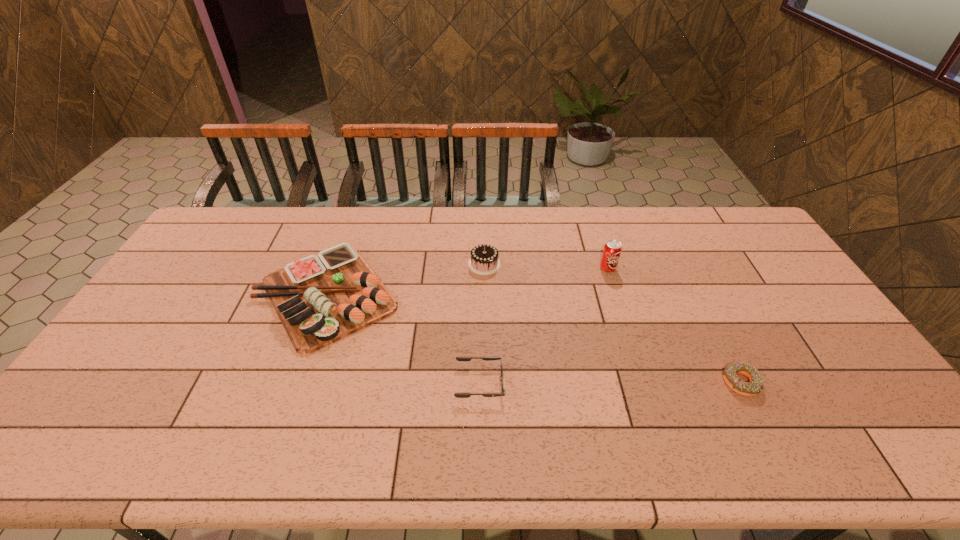
At what (x,y) coordinates should I click in order to perform the action: click on free space that is in between the tallest object and the rightmost object. Please return your answer as a coordinate pair (x, y). Image resolution: width=960 pixels, height=540 pixels. Looking at the image, I should click on (674, 326).

Find the location of a particular element. This screenshot has height=540, width=960. vacant region between the platter and the sunglasses is located at coordinates [x=403, y=339].

Locate an element on the screen. Image resolution: width=960 pixels, height=540 pixels. vacant area that lies between the chocolate cake and the rightmost object is located at coordinates (612, 323).

What are the coordinates of `vacant space that's between the rightmost object and the third tallest object` in the screenshot? It's located at (534, 339).

You are a GUI agent. You are given a task and a screenshot of the screen. Output one action in this format:
    pyautogui.click(x=<x>, y=<y>)
    Task: Click on the free space between the soda and the sunglasses
    The image size is (960, 540).
    Given the screenshot: What is the action you would take?
    pyautogui.click(x=543, y=326)

Identify which object is the nearest to the sunglasses. Please provide its 2D coordinates. Your answer should be formatted as a tuple, i.e. [(x, y)], where the tuple contains the x and y coordinates of a point satisfying the conditions above.

[(319, 299)]

This screenshot has width=960, height=540. Find the location of `object that stands as the third closest to the fourth shortest object`. object that stands as the third closest to the fourth shortest object is located at coordinates (459, 395).

Where is `free space that satisfies the following two spatial constraints: 1. on the front side of the second tallest object; 2. on the temples of the sunglasses`? free space that satisfies the following two spatial constraints: 1. on the front side of the second tallest object; 2. on the temples of the sunglasses is located at coordinates (486, 383).